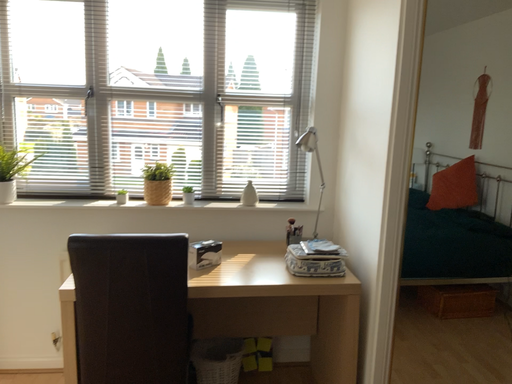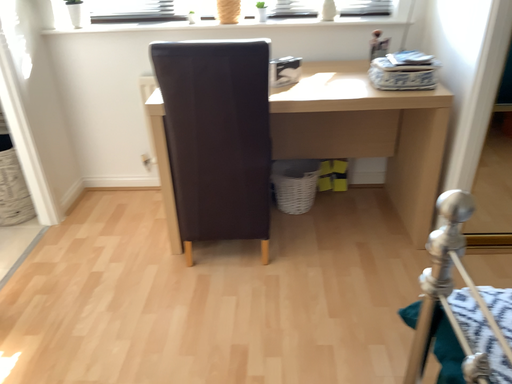
Question: Which way did the camera rotate in the video?

Choices:
 (A) rotated downward
 (B) rotated upward

Answer: (A)